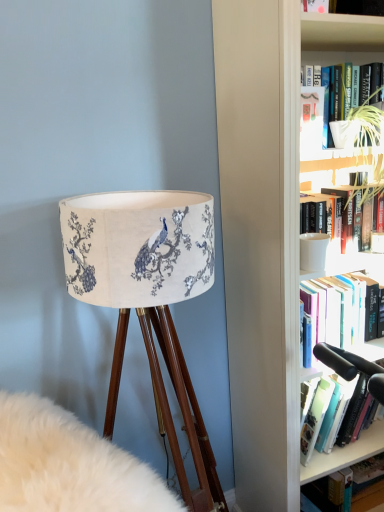
Question: From the image's perspective, is wooden tripod lamp at left on matte white paperback book at upper right?

Choices:
 (A) yes
 (B) no

Answer: (B)

Question: Can you confirm if wooden tripod lamp at left is taller than matte white paperback book at upper right?

Choices:
 (A) no
 (B) yes

Answer: (B)

Question: Is wooden tripod lamp at left far from matte white paperback book at upper right?

Choices:
 (A) yes
 (B) no

Answer: (B)

Question: From a real-world perspective, is wooden tripod lamp at left located beneath matte white paperback book at upper right?

Choices:
 (A) no
 (B) yes

Answer: (B)

Question: Is matte white paperback book at upper right at the back of wooden tripod lamp at left?

Choices:
 (A) no
 (B) yes

Answer: (A)

Question: In terms of height, does white matte mug at upper right, which appears as the second book when ordered from the bottom, look taller or shorter compared to wooden tripod lamp at left?

Choices:
 (A) short
 (B) tall

Answer: (A)

Question: In terms of size, does white matte mug at upper right, positioned as the first book in top-to-bottom order, appear bigger or smaller than wooden tripod lamp at left?

Choices:
 (A) small
 (B) big

Answer: (A)

Question: From a real-world perspective, is white matte mug at upper right, which is counted as the 1th book, starting from the front, physically located above or below wooden tripod lamp at left?

Choices:
 (A) above
 (B) below

Answer: (A)

Question: From the image's perspective, relative to wooden tripod lamp at left, is white matte mug at upper right, which is counted as the 1th book, starting from the front, above or below?

Choices:
 (A) above
 (B) below

Answer: (A)

Question: In terms of height, does white matte mug at upper right, positioned as the first book in top-to-bottom order, look taller or shorter compared to hardcover book at lower right, which appears as the first book when ordered from the bottom?

Choices:
 (A) tall
 (B) short

Answer: (A)

Question: Is white matte mug at upper right, positioned as the first book in top-to-bottom order, spatially inside hardcover book at lower right, the 1th book viewed from the back, or outside of it?

Choices:
 (A) outside
 (B) inside

Answer: (A)

Question: Visually, is white matte mug at upper right, which appears as the second book when ordered from the bottom, positioned to the left or to the right of hardcover book at lower right, which appears as the first book when ordered from the bottom?

Choices:
 (A) right
 (B) left

Answer: (B)

Question: Looking at their shapes, would you say white matte mug at upper right, positioned as the first book in top-to-bottom order, is wider or thinner than hardcover book at lower right, which appears as the first book when ordered from the bottom?

Choices:
 (A) wide
 (B) thin

Answer: (B)

Question: From their relative heights in the image, would you say matte fabric lampshade at left is taller or shorter than hardcover book at lower right, the second book in the front-to-back sequence?

Choices:
 (A) tall
 (B) short

Answer: (A)

Question: Considering the positions of point (192, 502) and point (347, 470), is point (192, 502) closer or farther from the camera than point (347, 470)?

Choices:
 (A) farther
 (B) closer

Answer: (B)